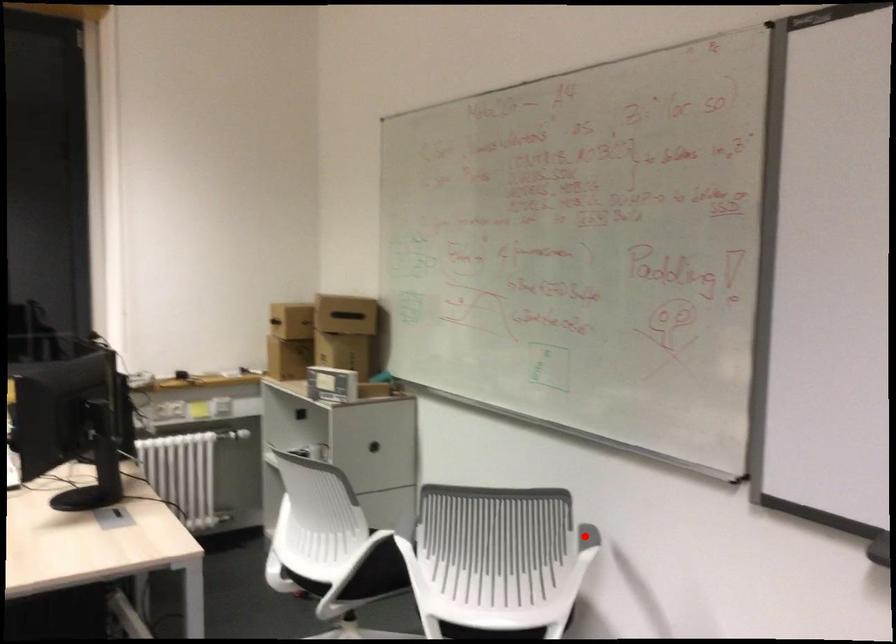
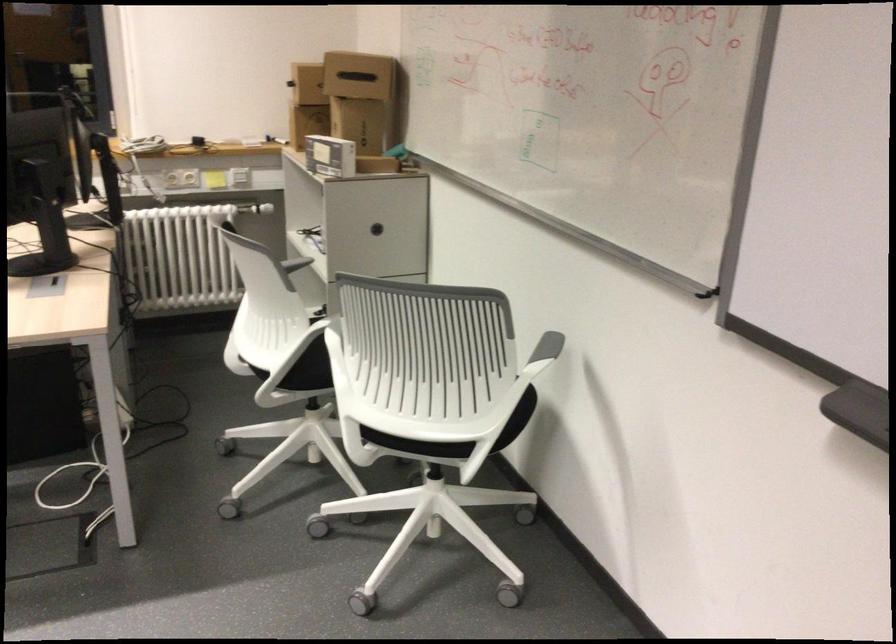
Question: I am providing you with two images of the same scene from different viewpoints. In image1, a red point is highlighted. Considering the same 3D point in image2, which of the following is correct?

Choices:
 (A) It is closer
 (B) It is farther

Answer: (A)